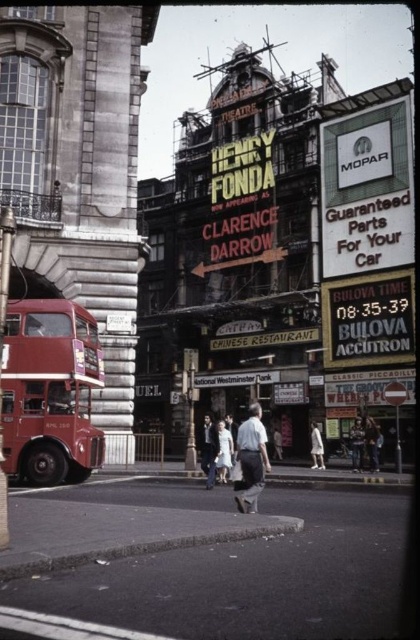
Based on the photo, who is more distant from viewer, (212, 461) or (356, 451)?

The point (356, 451) is more distant.

The height and width of the screenshot is (640, 420). Identify the location of light blue denim jacket at center. (209, 451).

Which is more to the left, maroon metallic bus at left or light blue shirt at center?

maroon metallic bus at left is more to the left.

This screenshot has width=420, height=640. I want to click on maroon metallic bus at left, so click(49, 392).

At what (x,y) coordinates should I click in order to perform the action: click on maroon metallic bus at left. Please return your answer as a coordinate pair (x, y). Image resolution: width=420 pixels, height=640 pixels. Looking at the image, I should click on coord(49,392).

Does point (220, 433) come farther from viewer compared to point (357, 461)?

No, it is in front of (357, 461).

Measure the distance from light blue shirt at center to dark blue jeans at center.

light blue shirt at center is 12.93 meters away from dark blue jeans at center.

This screenshot has width=420, height=640. Describe the element at coordinates (223, 451) in the screenshot. I see `light blue shirt at center` at that location.

You are a GUI agent. You are given a task and a screenshot of the screen. Output one action in this format:
    pyautogui.click(x=<x>, y=<y>)
    Task: Click on the light blue shirt at center
    This screenshot has width=420, height=640.
    Given the screenshot: What is the action you would take?
    pyautogui.click(x=223, y=451)